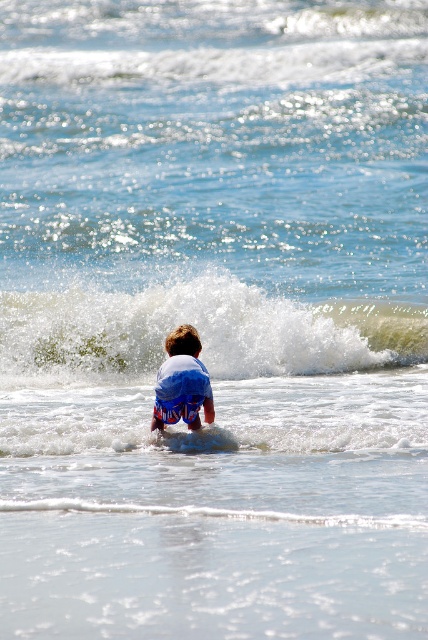
Does point (70, 308) come closer to viewer compared to point (195, 451)?

That is False.

Does white frothy wave at center have a greater width compared to smooth blue surfboard at center?

Indeed, white frothy wave at center has a greater width compared to smooth blue surfboard at center.

Who is more forward, (128,336) or (195,440)?

Point (195,440) is in front.

At what (x,y) coordinates should I click in order to perform the action: click on white frothy wave at center. Please return your answer as a coordinate pair (x, y). This screenshot has height=640, width=428. Looking at the image, I should click on (199, 332).

Does white frothy wave at center have a lesser width compared to blue cotton shorts at center?

No.

Is white frothy wave at center wider than blue cotton shorts at center?

Correct, the width of white frothy wave at center exceeds that of blue cotton shorts at center.

Is point (122, 328) in front of point (165, 413)?

No, (122, 328) is behind (165, 413).

The width and height of the screenshot is (428, 640). Find the location of `white frothy wave at center`. white frothy wave at center is located at coordinates (199, 332).

Is blue cotton shorts at center closer to the viewer compared to smooth blue surfboard at center?

No.

Based on the photo, can you confirm if blue cotton shorts at center is positioned to the left of smooth blue surfboard at center?

Indeed, blue cotton shorts at center is positioned on the left side of smooth blue surfboard at center.

Does point (205, 417) come behind point (168, 449)?

Yes, point (205, 417) is behind point (168, 449).

Find the location of `blue cotton shorts at center`. blue cotton shorts at center is located at coordinates (183, 381).